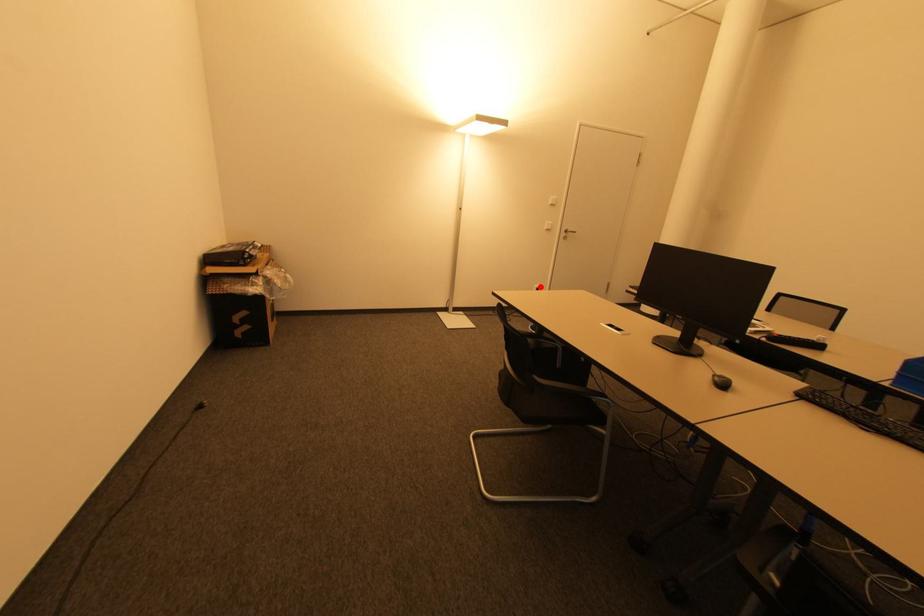
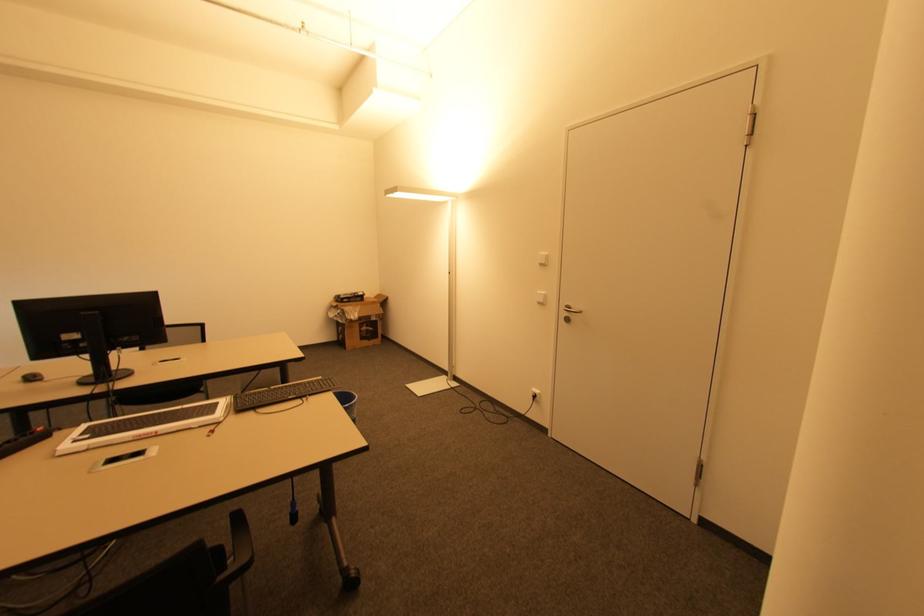
Question: I am providing you with two images of the same scene from different viewpoints. A red point is marked on the first image. Can you still see the location of the red point in image 2?

Choices:
 (A) Yes
 (B) No

Answer: (A)